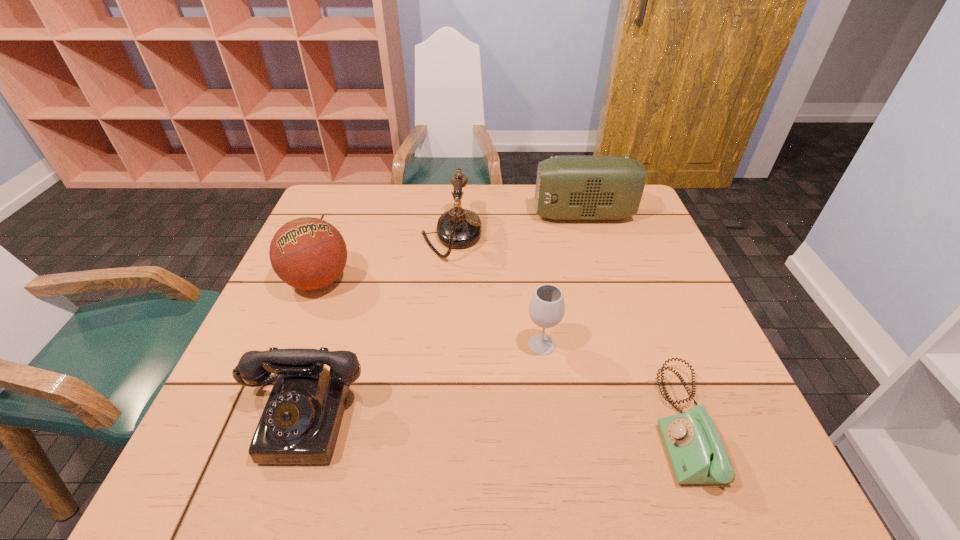
Find the location of a particular element. radio_receiver is located at coordinates (567, 187).

Where is `basketball`? basketball is located at coordinates (307, 253).

This screenshot has height=540, width=960. Find the location of `the third object from left to right`. the third object from left to right is located at coordinates (457, 228).

The image size is (960, 540). I want to click on the farthest telephone, so click(457, 228).

This screenshot has height=540, width=960. I want to click on the fourth farthest object, so click(546, 308).

The image size is (960, 540). What are the coordinates of `the leftmost telephone` in the screenshot? It's located at (300, 423).

Locate an element on the screen. Image resolution: width=960 pixels, height=540 pixels. the shortest object is located at coordinates (697, 455).

Image resolution: width=960 pixels, height=540 pixels. I want to click on the shortest telephone, so click(x=697, y=455).

In order to click on vacant point located on the front-facing side of the radio_receiver in this screenshot , I will do `click(427, 215)`.

Where is `vacant space situated on the front-facing side of the radio_receiver`? vacant space situated on the front-facing side of the radio_receiver is located at coordinates (405, 215).